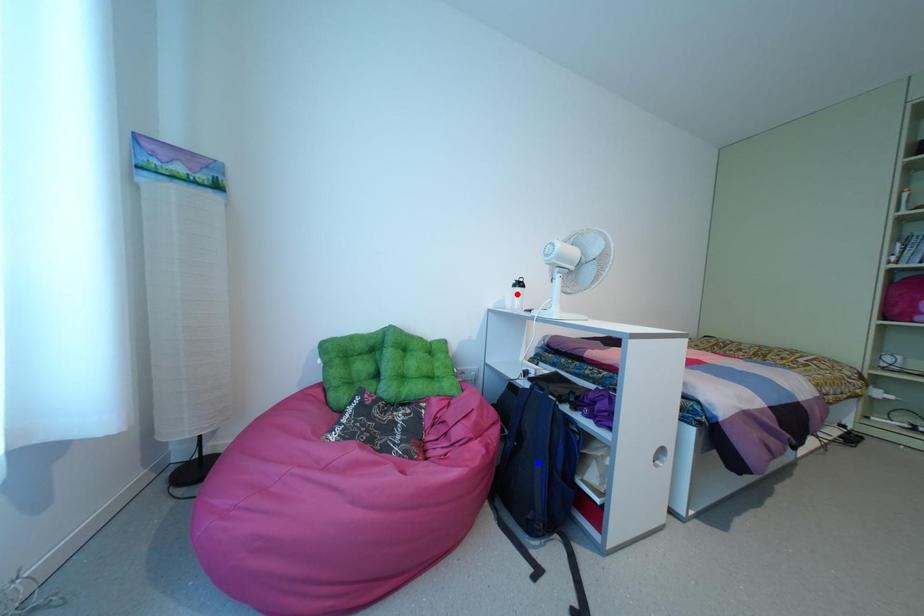
Question: In the image, two points are highlighted. Which point is nearer to the camera? Reply with the corresponding letter.

Choices:
 (A) blue point
 (B) red point

Answer: (A)